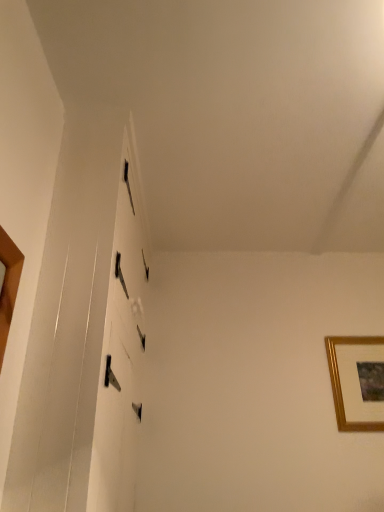
In order to click on gold-framed picture at upper right in this screenshot , I will do `click(357, 382)`.

Describe the element at coordinates (357, 382) in the screenshot. I see `gold-framed picture at upper right` at that location.

The image size is (384, 512). I want to click on gold-framed picture at upper right, so click(357, 382).